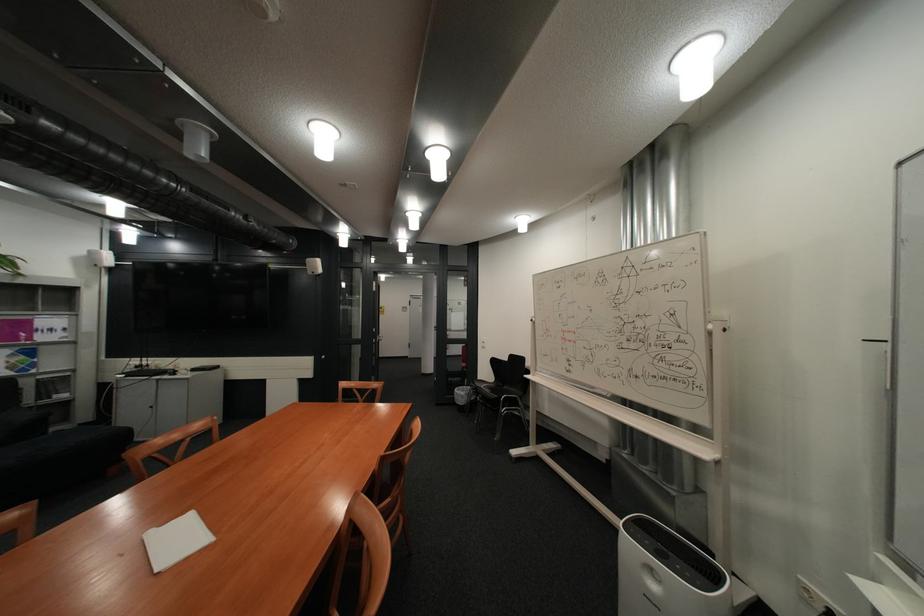
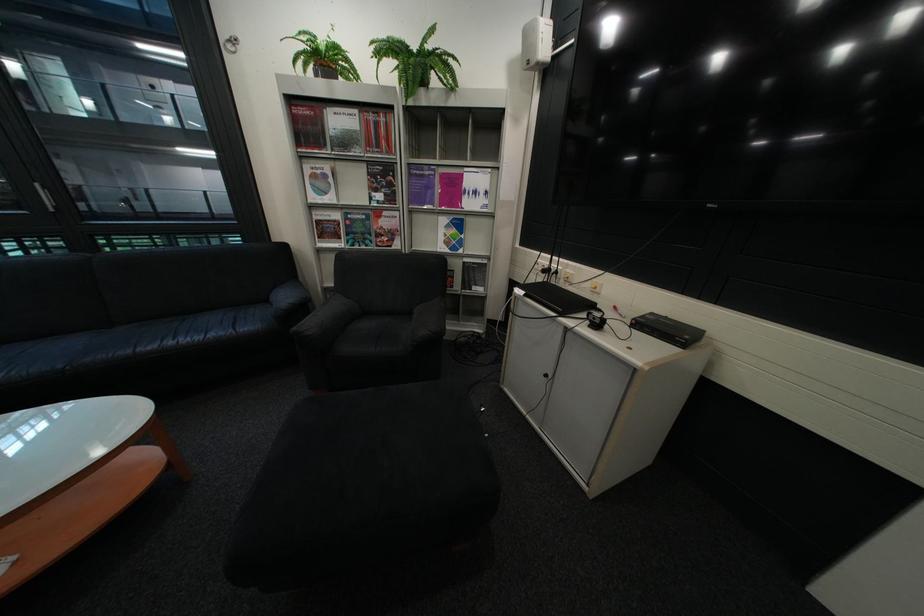
Locate, in the second image, the point that corresponds to (x=139, y=376) in the first image.

(538, 293)